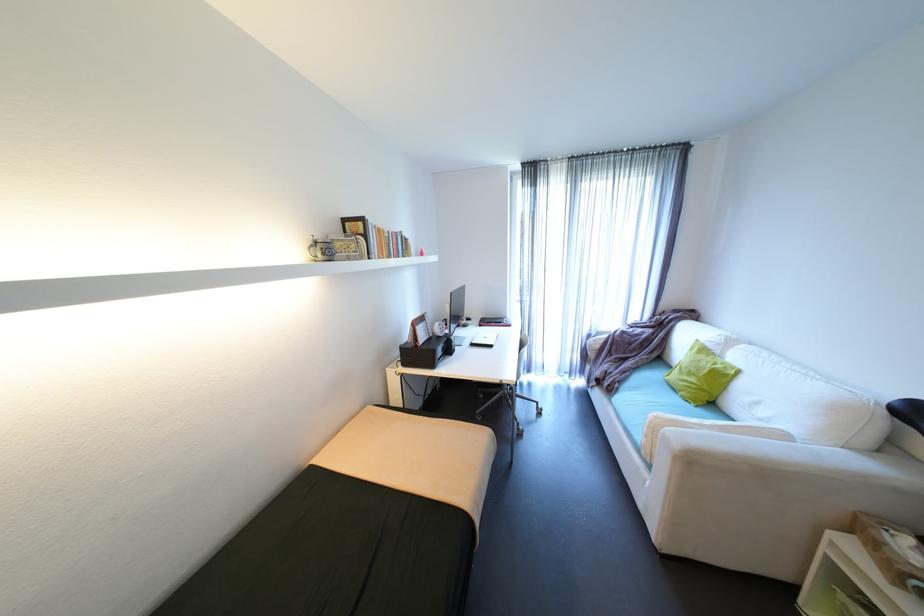
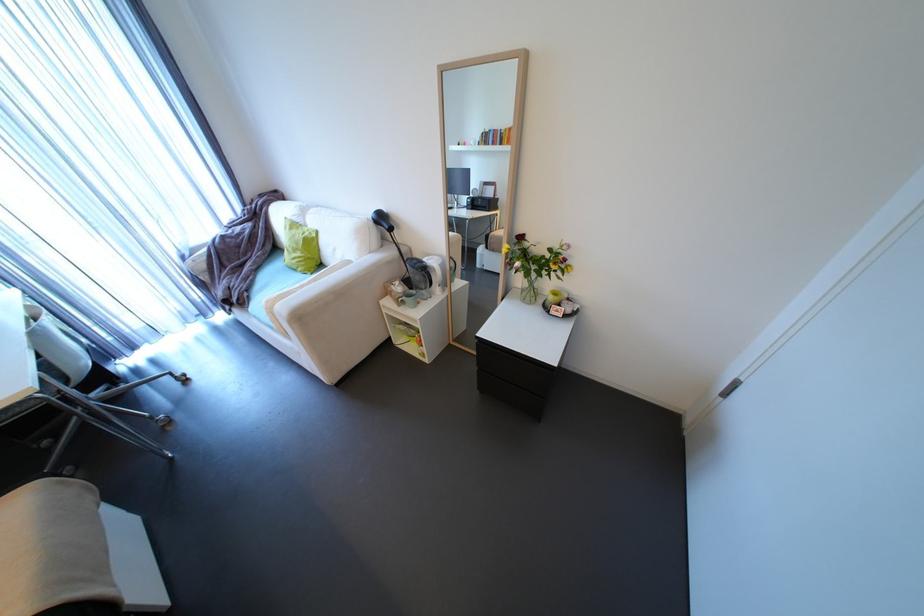
Where in the second image is the point corresponding to point 601,334 from the first image?

(195, 254)